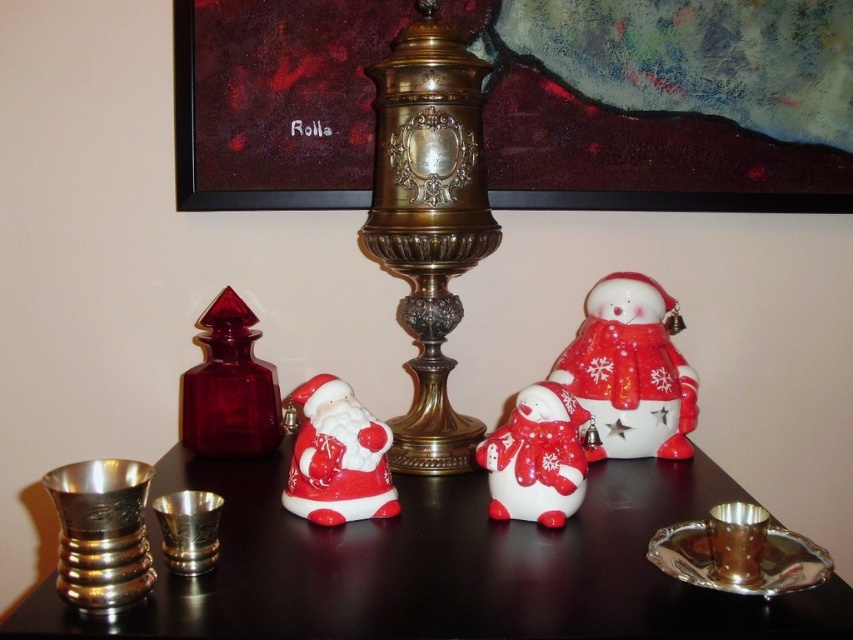
Question: Among these objects, which one is nearest to the camera?

Choices:
 (A) matte ceramic santa at center
 (B) ruby glass bottle at left
 (C) shiny gold candle holder at lower right
 (D) brass/copper candle holder at center

Answer: (C)

Question: Among these objects, which one is farthest from the camera?

Choices:
 (A) brushed metal cups at left
 (B) brass/copper candle holder at center
 (C) ruby glass bottle at left

Answer: (C)

Question: Is brushed metal cups at left wider than brushed metal candle holder at lower left?

Choices:
 (A) no
 (B) yes

Answer: (B)

Question: Which of the following is the farthest from the observer?

Choices:
 (A) (605, 294)
 (B) (288, 12)
 (C) (268, 392)
 (D) (746, 579)

Answer: (B)

Question: Does brushed metal candle holder at lower left have a smaller size compared to shiny gold candle holder at lower right?

Choices:
 (A) no
 (B) yes

Answer: (B)

Question: Is brass/copper candle holder at center bigger than white glossy snowman at center?

Choices:
 (A) no
 (B) yes

Answer: (B)